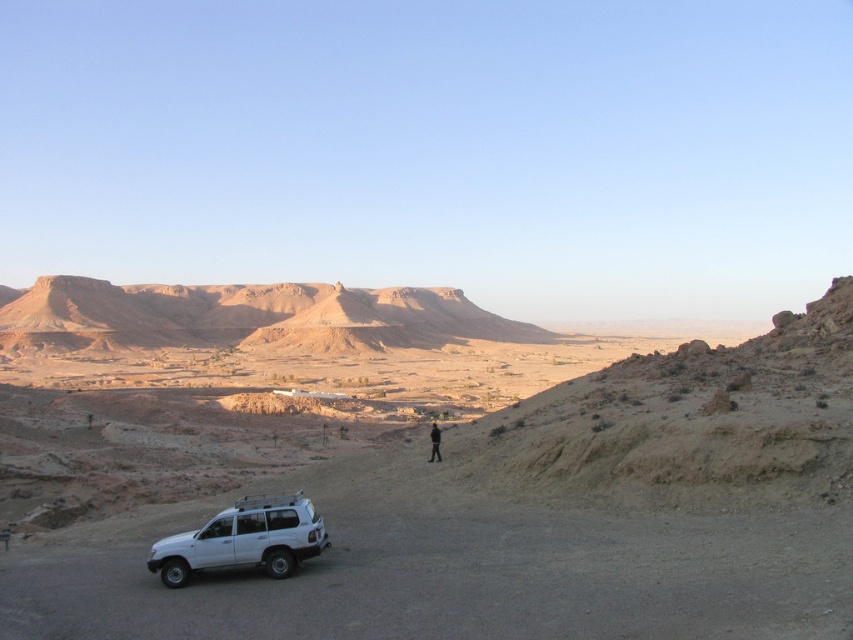
From the picture: Who is lower down, brown rocky mountain at upper center or black fabric person at center?

black fabric person at center is below.

Locate an element on the screen. brown rocky mountain at upper center is located at coordinates (247, 316).

Looking at this image, does brown rocky mountain at upper center have a lesser width compared to white matte jeep at lower left?

No.

Locate an element on the screen. This screenshot has height=640, width=853. brown rocky mountain at upper center is located at coordinates (247, 316).

This screenshot has width=853, height=640. In order to click on brown rocky mountain at upper center in this screenshot , I will do [x=247, y=316].

Is white matte jeep at lower left bigger than black fabric person at center?

Indeed, white matte jeep at lower left has a larger size compared to black fabric person at center.

Does white matte jeep at lower left appear over black fabric person at center?

Indeed, white matte jeep at lower left is positioned over black fabric person at center.

Does point (181, 552) come in front of point (431, 445)?

Yes.

Identify the location of white matte jeep at lower left. (244, 540).